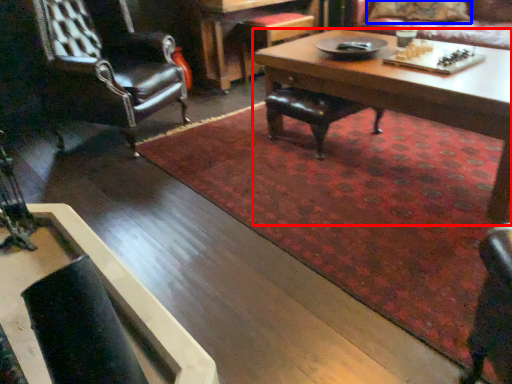
Question: Which object is closer to the camera taking this photo, coffee table (highlighted by a red box) or pillow (highlighted by a blue box)?

Choices:
 (A) coffee table
 (B) pillow

Answer: (A)